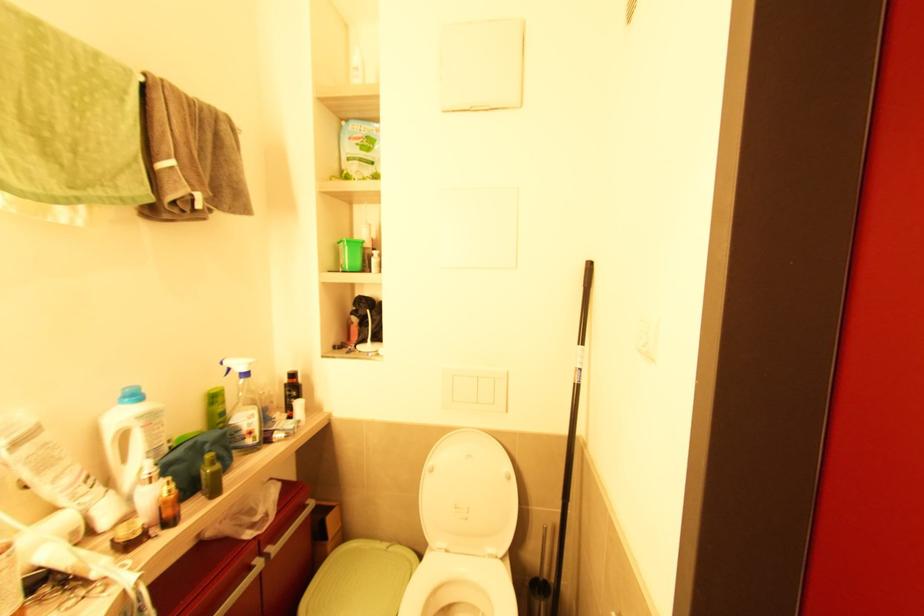
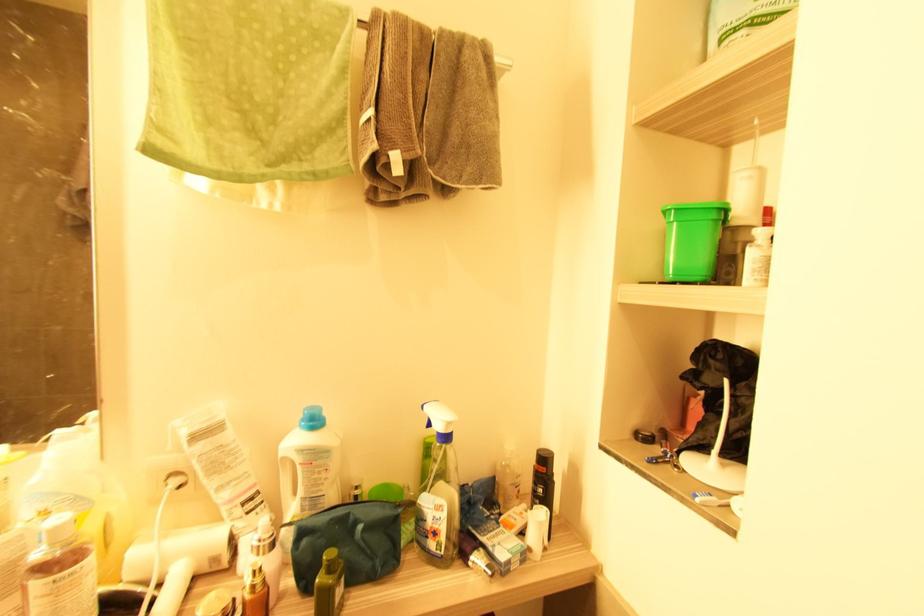
Locate, in the second image, the point that corresponds to pixel 152 477 in the first image.

(261, 546)